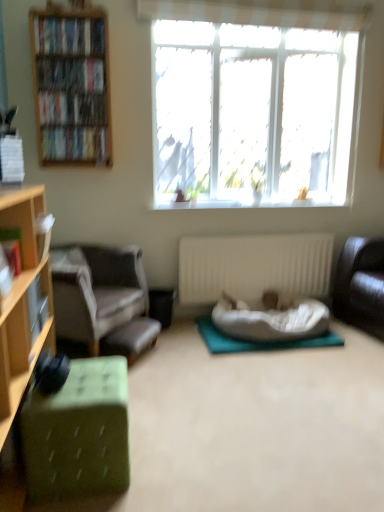
The image size is (384, 512). Find the location of `free location to the right of green fabric ottoman at lower left`. free location to the right of green fabric ottoman at lower left is located at coordinates (175, 457).